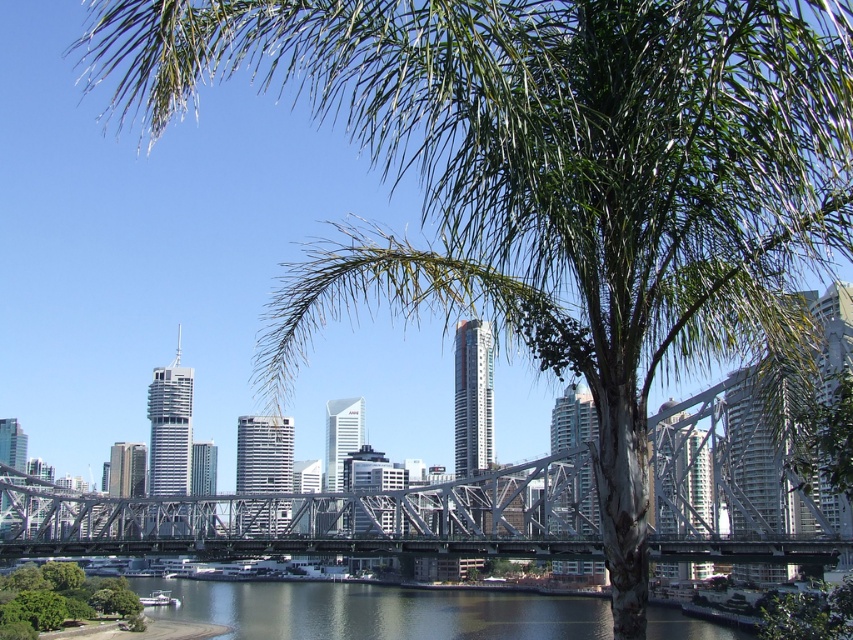
Does metallic gray bridge at center appear on the right side of green leafy tree at lower right?

Incorrect, metallic gray bridge at center is not on the right side of green leafy tree at lower right.

Who is shorter, metallic gray bridge at center or green leafy tree at lower right?

Standing shorter between the two is green leafy tree at lower right.

Which is in front, point (223, 548) or point (805, 614)?

Point (805, 614)

At what (x,y) coordinates should I click in order to perform the action: click on metallic gray bridge at center. Please return your answer as a coordinate pair (x, y). The height and width of the screenshot is (640, 853). Looking at the image, I should click on (322, 518).

Is green leafy tree at lower left bigger than green leafy tree at lower right?

Yes, green leafy tree at lower left is bigger than green leafy tree at lower right.

Based on the photo, can you confirm if green leafy tree at lower left is positioned to the right of green leafy tree at lower right?

Incorrect, green leafy tree at lower left is not on the right side of green leafy tree at lower right.

Which is behind, point (22, 618) or point (778, 621)?

The point (22, 618) is behind.

The image size is (853, 640). Find the location of `green leafy tree at lower left`. green leafy tree at lower left is located at coordinates (57, 596).

Is metallic gray bridge at center behind dark blue water at lower center?

No, metallic gray bridge at center is in front of dark blue water at lower center.

Is metallic gray bridge at center below dark blue water at lower center?

No.

The width and height of the screenshot is (853, 640). Describe the element at coordinates (322, 518) in the screenshot. I see `metallic gray bridge at center` at that location.

You are a GUI agent. You are given a task and a screenshot of the screen. Output one action in this format:
    pyautogui.click(x=<x>, y=<y>)
    Task: Click on the metallic gray bridge at center
    Image resolution: width=853 pixels, height=640 pixels.
    Given the screenshot: What is the action you would take?
    pyautogui.click(x=322, y=518)